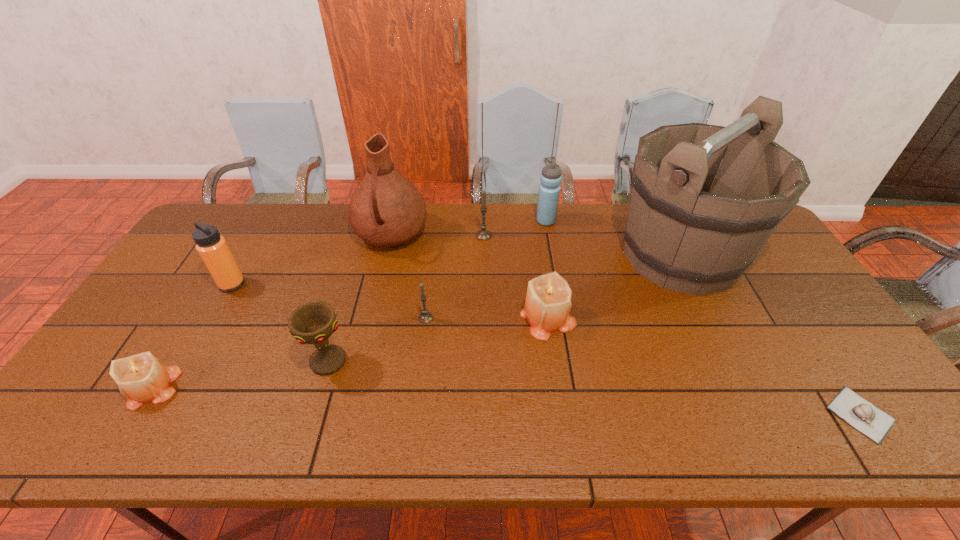
Locate an element on the screen. This screenshot has height=540, width=960. free spot between the red chalice and the rightmost candle is located at coordinates (439, 339).

At what (x,y) coordinates should I click in order to perform the action: click on unoccupied position between the chalice and the pitcher. Please return your answer as a coordinate pair (x, y). The image size is (960, 540). Looking at the image, I should click on (360, 298).

Identify the location of free area in between the nearer gray candle and the red chalice. The width and height of the screenshot is (960, 540). [x=377, y=339].

At what (x,y) coordinates should I click in order to perform the action: click on free space between the leftmost candle and the second tallest object. Please return your answer as a coordinate pair (x, y). Looking at the image, I should click on (274, 311).

The height and width of the screenshot is (540, 960). Identify the location of unoccupied area between the tallest object and the pitcher. tap(536, 245).

Where is `vacant point located between the shortest object and the right beige candle`? vacant point located between the shortest object and the right beige candle is located at coordinates (705, 366).

Locate an element on the screen. vacant area that lies between the bigger beige candle and the red chalice is located at coordinates (439, 339).

In order to click on object that ranks as the ninth closest to the red chalice in this screenshot , I will do `click(867, 418)`.

The image size is (960, 540). Find the location of `the ninth closest object to the pitcher`. the ninth closest object to the pitcher is located at coordinates (867, 418).

Locate an element on the screen. Image resolution: width=960 pixels, height=540 pixels. candle object that ranks as the third closest to the bigger gray candle is located at coordinates (142, 378).